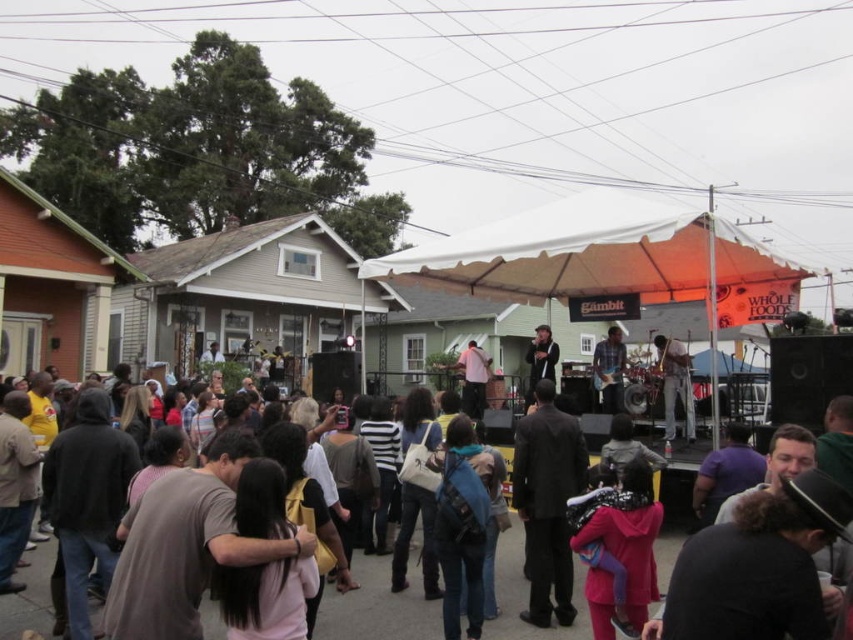
You are a photographer at the event and want to ensure both the matte black jacket at center and the metallic silver guitar at center are clearly visible in your photo. Since you can only focus on one subject, which one should you choose to ensure the other remains in the background without being too cropped out?

The matte black jacket at center has a lesser height compared to metallic silver guitar at center. Therefore, focusing on the metallic silver guitar at center would allow the matte black jacket at center to be visible in the background without being overly cropped, as the guitar is taller and occupies more vertical space.